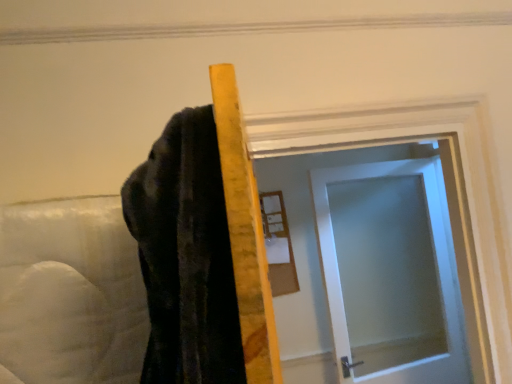
Where is `wooden framed mirror at upper center`? wooden framed mirror at upper center is located at coordinates (278, 245).

Measure the distance between point [283,274] and camera.

Point [283,274] and camera are 2.49 meters apart.

Describe the element at coordinates (278, 245) in the screenshot. This screenshot has height=384, width=512. I see `wooden framed mirror at upper center` at that location.

You are a GUI agent. You are given a task and a screenshot of the screen. Output one action in this format:
    pyautogui.click(x=<x>, y=<y>)
    Task: Click on the satin white door at center
    
    Given the screenshot: What is the action you would take?
    pyautogui.click(x=390, y=272)

What do you see at coordinates (390, 272) in the screenshot? I see `satin white door at center` at bounding box center [390, 272].

This screenshot has width=512, height=384. Identify the location of wooden framed mirror at upper center. (278, 245).

Between wooden framed mirror at upper center and satin white door at center, which one appears on the right side from the viewer's perspective?

Positioned to the right is satin white door at center.

Which is behind, wooden framed mirror at upper center or satin white door at center?

Positioned behind is wooden framed mirror at upper center.

Considering the points (271, 269) and (449, 272), which point is in front, point (271, 269) or point (449, 272)?

The point (449, 272) is more forward.

From the image's perspective, which object appears higher, wooden framed mirror at upper center or satin white door at center?

wooden framed mirror at upper center.

From a real-world perspective, which is physically above, wooden framed mirror at upper center or satin white door at center?

wooden framed mirror at upper center.

Considering the sizes of objects wooden framed mirror at upper center and satin white door at center in the image provided, who is thinner, wooden framed mirror at upper center or satin white door at center?

wooden framed mirror at upper center.

Can you confirm if wooden framed mirror at upper center is taller than satin white door at center?

Incorrect, the height of wooden framed mirror at upper center is not larger of that of satin white door at center.

Is wooden framed mirror at upper center bigger than satin white door at center?

Incorrect, wooden framed mirror at upper center is not larger than satin white door at center.

Is wooden framed mirror at upper center situated inside satin white door at center or outside?

wooden framed mirror at upper center lies outside satin white door at center.

Can you see wooden framed mirror at upper center touching satin white door at center?

No, wooden framed mirror at upper center is not touching satin white door at center.

Could you tell me if wooden framed mirror at upper center is turned towards satin white door at center?

No, wooden framed mirror at upper center is not facing towards satin white door at center.

How many degrees apart are the facing directions of wooden framed mirror at upper center and satin white door at center?

The facing directions of wooden framed mirror at upper center and satin white door at center are 8.49 degrees apart.

The width and height of the screenshot is (512, 384). Find the location of `door below the wooden framed mirror at upper center (from the image's perspective)`. door below the wooden framed mirror at upper center (from the image's perspective) is located at coordinates (390, 272).

Which object is positioned more to the left, satin white door at center or wooden framed mirror at upper center?

Positioned to the left is wooden framed mirror at upper center.

Based on the photo, does satin white door at center lie behind wooden framed mirror at upper center?

No, the depth of satin white door at center is less than that of wooden framed mirror at upper center.

Does point (437, 363) appear closer or farther from the camera than point (287, 288)?

Point (437, 363) is positioned closer to the camera compared to point (287, 288).

From the image's perspective, does satin white door at center appear lower than wooden framed mirror at upper center?

Correct, satin white door at center appears lower than wooden framed mirror at upper center in the image.

From a real-world perspective, is satin white door at center positioned over wooden framed mirror at upper center based on gravity?

No, from a real-world perspective, satin white door at center is not over wooden framed mirror at upper center

Which object is thinner, satin white door at center or wooden framed mirror at upper center?

wooden framed mirror at upper center is thinner.

Which of these two, satin white door at center or wooden framed mirror at upper center, stands shorter?

wooden framed mirror at upper center.

Who is smaller, satin white door at center or wooden framed mirror at upper center?

wooden framed mirror at upper center is smaller.

Does satin white door at center contain wooden framed mirror at upper center?

No, satin white door at center does not contain wooden framed mirror at upper center.

Is satin white door at center positioned far away from wooden framed mirror at upper center?

No, satin white door at center is in close proximity to wooden framed mirror at upper center.

Is satin white door at center facing towards wooden framed mirror at upper center?

No.

The image size is (512, 384). What are the coordinates of `door below the wooden framed mirror at upper center (from the image's perspective)` in the screenshot? It's located at (390, 272).

Locate an element on the screen. This screenshot has width=512, height=384. door below the wooden framed mirror at upper center (from a real-world perspective) is located at coordinates (390, 272).

Identify the location of mirror that is on the left side of satin white door at center. pyautogui.click(x=278, y=245).